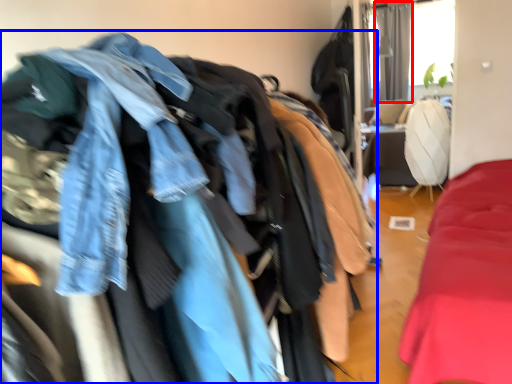
Question: Which point is closer to the camera, curtain (highlighted by a red box) or jacket (highlighted by a blue box)?

Choices:
 (A) curtain
 (B) jacket

Answer: (B)